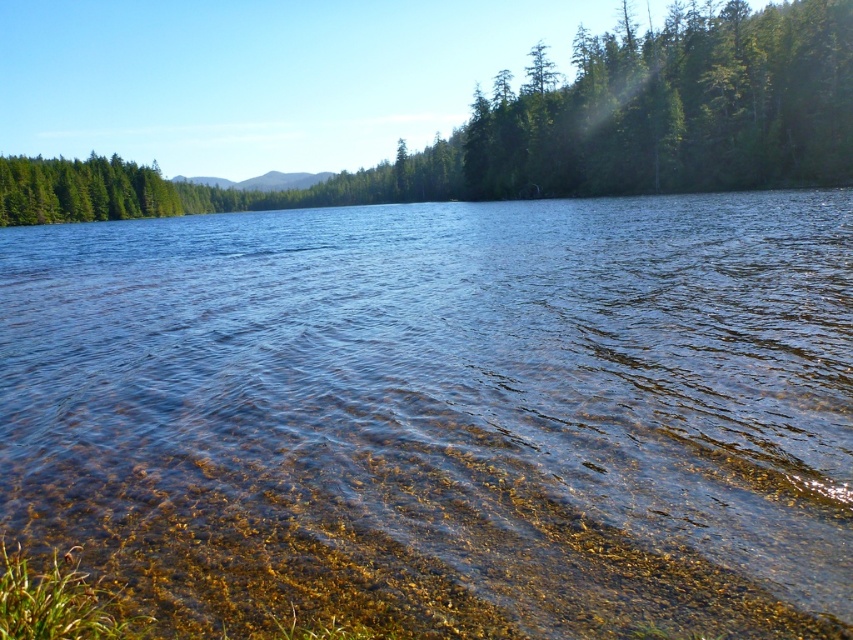
You are standing at the lakeshore and see the clear water at center and the green matte tree at upper center. Which object is positioned to the right of the other?

The clear water at center is to the right of the green matte tree at upper center.

You are standing on the lakeshore and looking towards the distant hills. Which object, the clear water at center or the green matte tree at upper center, is closer to you?

The clear water at center is closer to you because it is in front of the green matte tree at upper center.

You are standing at the origin point in the image. Where is the clear water at center located in terms of its 2D coordinates?

The clear water at center is located at the 2D coordinates of point (445, 412).